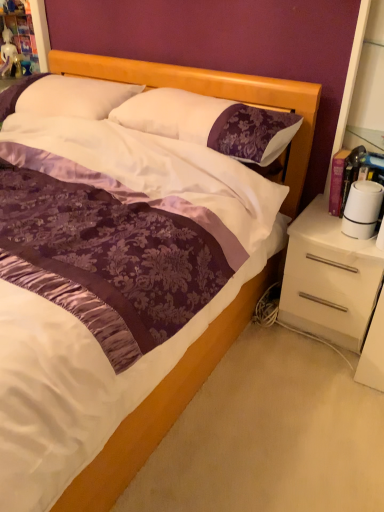
Question: Is white satin pillow at upper center, acting as the second pillow starting from the right, next to purple satin pillow at center, the 1th pillow when ordered from right to left?

Choices:
 (A) no
 (B) yes

Answer: (A)

Question: From a real-world perspective, is white satin pillow at upper center, acting as the second pillow starting from the right, on top of purple satin pillow at center, positioned as the 2th pillow in left-to-right order?

Choices:
 (A) yes
 (B) no

Answer: (B)

Question: From the image's perspective, does white satin pillow at upper center, placed as the first pillow when sorted from left to right, appear lower than purple satin pillow at center, the 1th pillow when ordered from right to left?

Choices:
 (A) yes
 (B) no

Answer: (B)

Question: Does white satin pillow at upper center, acting as the second pillow starting from the right, appear on the left side of purple satin pillow at center, the 1th pillow when ordered from right to left?

Choices:
 (A) yes
 (B) no

Answer: (A)

Question: Is white satin pillow at upper center, acting as the second pillow starting from the right, looking in the opposite direction of purple satin pillow at center, positioned as the 2th pillow in left-to-right order?

Choices:
 (A) yes
 (B) no

Answer: (B)

Question: Would you say white glossy drawer at right is to the left or to the right of white glossy dresser at right in the picture?

Choices:
 (A) right
 (B) left

Answer: (A)

Question: Relative to white glossy dresser at right, is white glossy drawer at right in front or behind?

Choices:
 (A) front
 (B) behind

Answer: (B)

Question: In terms of width, does white glossy drawer at right look wider or thinner when compared to white glossy dresser at right?

Choices:
 (A) wide
 (B) thin

Answer: (A)

Question: Considering the positions of point 314,288 and point 294,322, is point 314,288 closer or farther from the camera than point 294,322?

Choices:
 (A) closer
 (B) farther

Answer: (A)

Question: Is purple satin pillow at center, the 1th pillow when ordered from right to left, spatially inside white glossy drawer at right, or outside of it?

Choices:
 (A) inside
 (B) outside

Answer: (B)

Question: Is purple satin pillow at center, the 1th pillow when ordered from right to left, taller or shorter than white glossy drawer at right?

Choices:
 (A) short
 (B) tall

Answer: (A)

Question: Does point (x=246, y=147) appear closer or farther from the camera than point (x=301, y=303)?

Choices:
 (A) closer
 (B) farther

Answer: (A)

Question: From the image's perspective, is purple satin pillow at center, positioned as the 2th pillow in left-to-right order, positioned above or below white glossy drawer at right?

Choices:
 (A) below
 (B) above

Answer: (B)

Question: Is white satin pillow at upper center, placed as the first pillow when sorted from left to right, wider or thinner than white glossy drawer at right?

Choices:
 (A) thin
 (B) wide

Answer: (A)

Question: Choose the correct answer: Is white satin pillow at upper center, placed as the first pillow when sorted from left to right, inside white glossy drawer at right or outside it?

Choices:
 (A) outside
 (B) inside

Answer: (A)